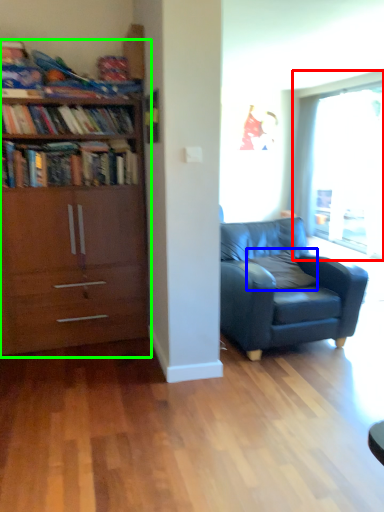
Question: Which object is positioned closest to window (highlighted by a red box)? Select from pillow (highlighted by a blue box) and bookcase (highlighted by a green box).

Choices:
 (A) pillow
 (B) bookcase

Answer: (A)